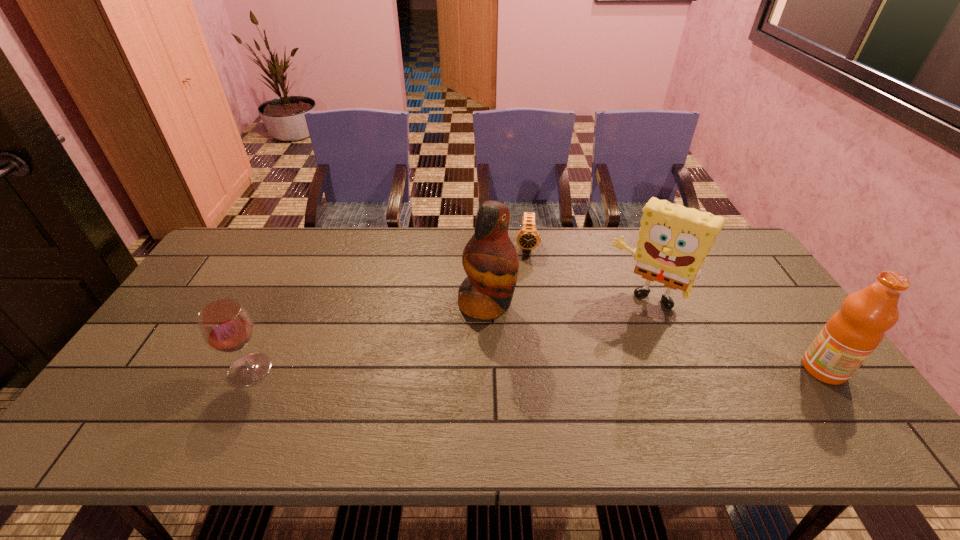
Where is `vacant region between the sponge and the shortest object`? The width and height of the screenshot is (960, 540). vacant region between the sponge and the shortest object is located at coordinates (587, 272).

Where is `empty space that is in between the sponge and the parrot`? The image size is (960, 540). empty space that is in between the sponge and the parrot is located at coordinates (566, 301).

Where is `vacant space in between the sponge and the shortest object`? The height and width of the screenshot is (540, 960). vacant space in between the sponge and the shortest object is located at coordinates (587, 272).

The height and width of the screenshot is (540, 960). I want to click on free space between the leftmost object and the second object from right to left, so click(448, 334).

Find the location of a particular element. free spot between the fourth object from left to right and the second shortest object is located at coordinates (448, 334).

Locate an element on the screen. vacant space that is in between the farthest object and the leftmost object is located at coordinates (389, 308).

Identify the location of empty location between the second shortest object and the shortest object. This screenshot has height=540, width=960. (389, 308).

Identify which object is the nearest to the third object from right to left. Please provide its 2D coordinates. Your answer should be formatted as a tuple, i.e. [(x, y)], where the tuple contains the x and y coordinates of a point satisfying the conditions above.

[(490, 260)]

Locate an element on the screen. object that is the second closest to the second object from left to right is located at coordinates (674, 241).

Identify the location of free space in the image that satisfies the following two spatial constraints: 1. on the front side of the third object from right to left; 2. on the right side of the sponge. (534, 298).